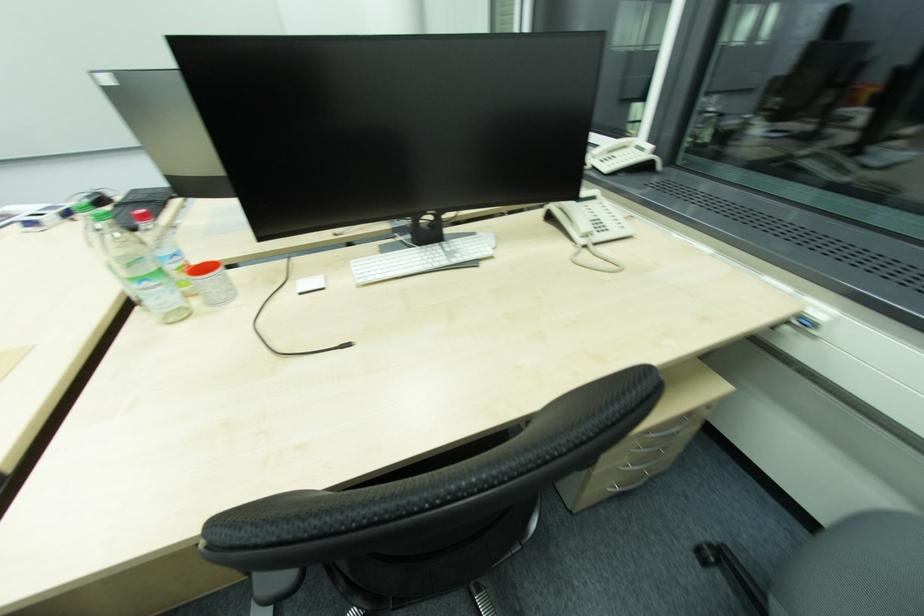
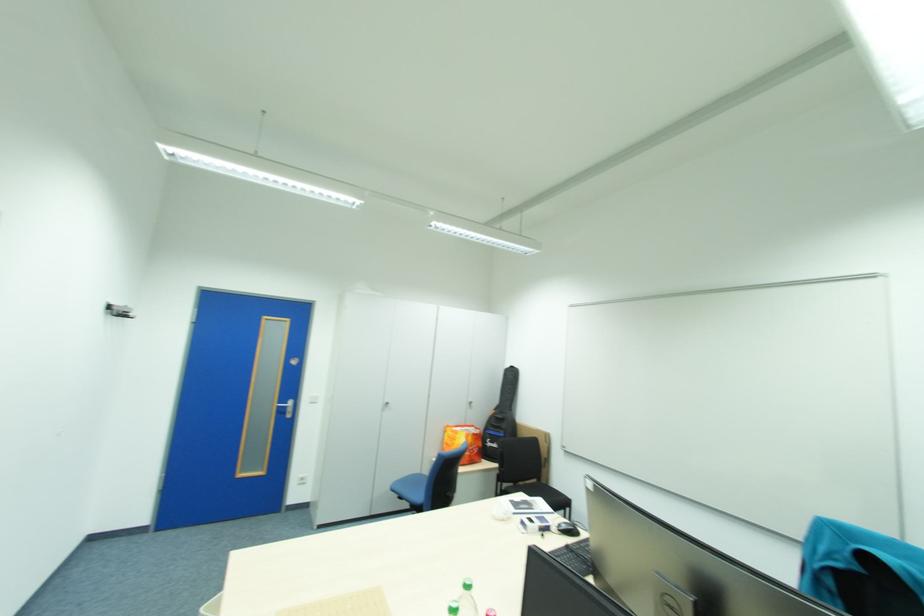
Question: Based on the continuous images, in which direction is the camera rotating? Reply with the corresponding letter.

Choices:
 (A) Left
 (B) Right
 (C) Up
 (D) Down

Answer: (A)